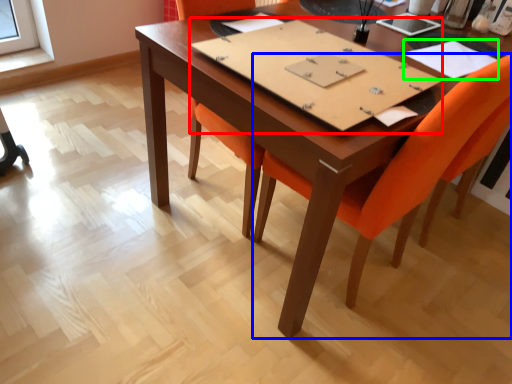
Question: Which is nearer to the notebook (highlighted by a red box)? chair (highlighted by a blue box) or notebook (highlighted by a green box).

Choices:
 (A) chair
 (B) notebook

Answer: (A)